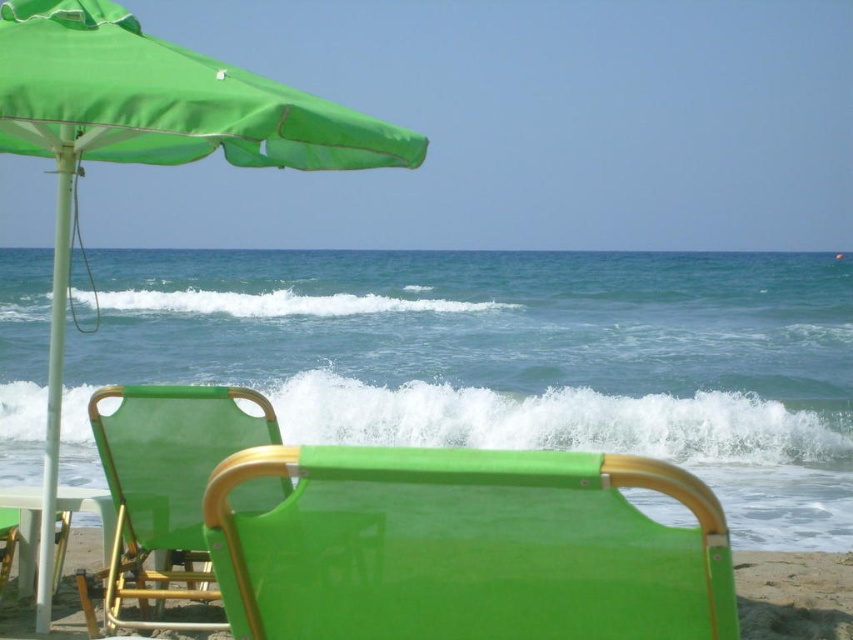
Question: Among these objects, which one is farthest from the camera?

Choices:
 (A) green fabric umbrella at upper left
 (B) green fabric beach chair at center
 (C) matte green fabric beach chair at lower left

Answer: (C)

Question: Considering the real-world distances, which object is farthest from the green fabric beach chair at center?

Choices:
 (A) matte green fabric beach chair at lower left
 (B) green fabric umbrella at upper left

Answer: (A)

Question: Can you confirm if green fabric beach chair at center is positioned to the right of green fabric umbrella at upper left?

Choices:
 (A) yes
 (B) no

Answer: (A)

Question: Which point is farther from the camera taking this photo?

Choices:
 (A) (134, 131)
 (B) (334, 452)
 (C) (215, 436)

Answer: (C)

Question: Is green fabric umbrella at upper left above matte green fabric beach chair at lower left?

Choices:
 (A) no
 (B) yes

Answer: (B)

Question: Is green fabric umbrella at upper left bigger than matte green fabric beach chair at lower left?

Choices:
 (A) no
 (B) yes

Answer: (B)